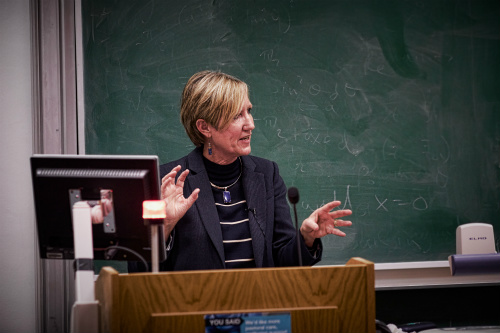
Find the location of a particular element. This screenshot has width=500, height=333. chalkboard side trim is located at coordinates (79, 8), (81, 108).